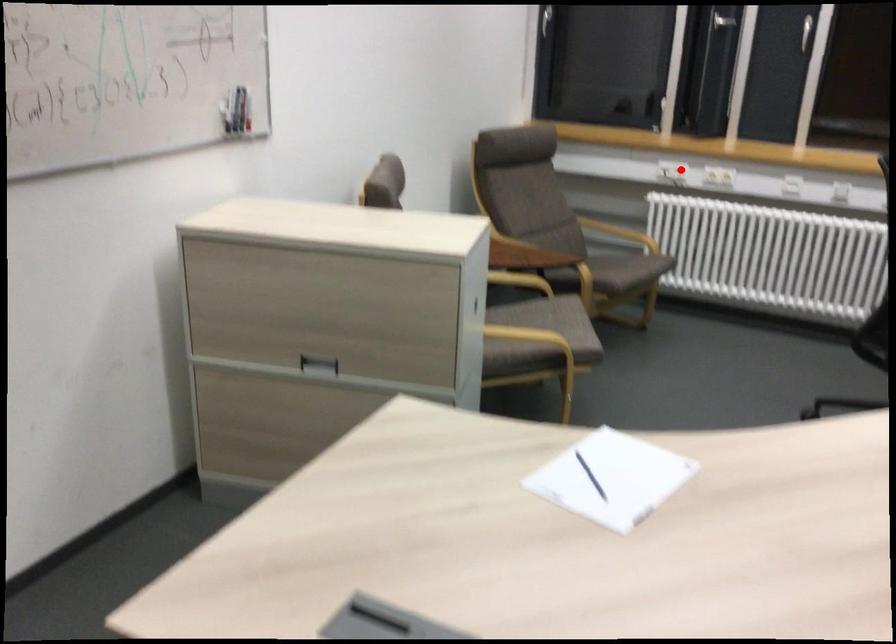
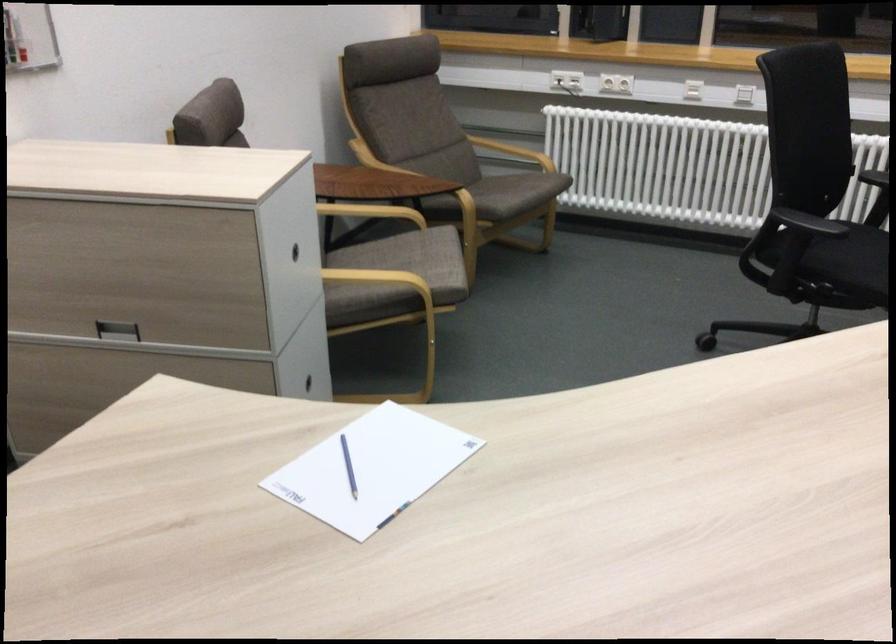
Where in the second image is the point corresponding to the highlighted location from the first image?

(566, 80)